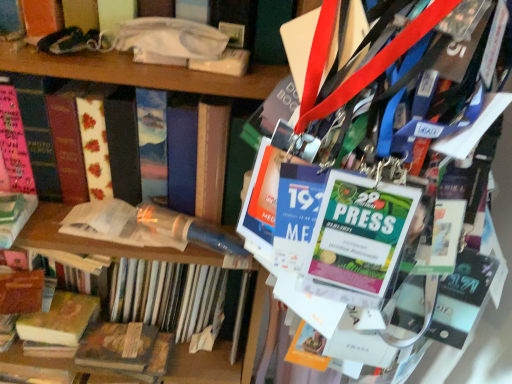
Question: Is translucent plastic tube at center, the second book in the top-to-bottom sequence, thinner than yellow paperback book at lower left, which ranks as the 2th book in bottom-to-top order?

Choices:
 (A) no
 (B) yes

Answer: (A)

Question: Considering the relative positions of translucent plastic tube at center, which is counted as the 3th book, starting from the bottom, and yellow paperback book at lower left, which appears as the third book when viewed from the top, in the image provided, is translucent plastic tube at center, which is counted as the 3th book, starting from the bottom, to the left of yellow paperback book at lower left, which appears as the third book when viewed from the top, from the viewer's perspective?

Choices:
 (A) yes
 (B) no

Answer: (B)

Question: From a real-world perspective, does translucent plastic tube at center, the second book in the top-to-bottom sequence, sit lower than yellow paperback book at lower left, which ranks as the 2th book in bottom-to-top order?

Choices:
 (A) yes
 (B) no

Answer: (B)

Question: Is translucent plastic tube at center, the second book in the top-to-bottom sequence, outside of yellow paperback book at lower left, which ranks as the 2th book in bottom-to-top order?

Choices:
 (A) no
 (B) yes

Answer: (B)

Question: Can you confirm if translucent plastic tube at center, the second book in the top-to-bottom sequence, is taller than yellow paperback book at lower left, which ranks as the 2th book in bottom-to-top order?

Choices:
 (A) yes
 (B) no

Answer: (A)

Question: Considering the relative positions of wooden book at lower left, the fourth book when ordered from top to bottom, and yellow paperback book at lower left, which appears as the third book when viewed from the top, in the image provided, is wooden book at lower left, the fourth book when ordered from top to bottom, to the left or to the right of yellow paperback book at lower left, which appears as the third book when viewed from the top,?

Choices:
 (A) right
 (B) left

Answer: (A)

Question: Considering the positions of point (129, 354) and point (65, 316), is point (129, 354) closer or farther from the camera than point (65, 316)?

Choices:
 (A) closer
 (B) farther

Answer: (A)

Question: From a real-world perspective, is wooden book at lower left, the fourth book when ordered from top to bottom, above or below yellow paperback book at lower left, which ranks as the 2th book in bottom-to-top order?

Choices:
 (A) above
 (B) below

Answer: (B)

Question: Is wooden book at lower left, the fourth book when ordered from top to bottom, bigger or smaller than yellow paperback book at lower left, which ranks as the 2th book in bottom-to-top order?

Choices:
 (A) big
 (B) small

Answer: (A)

Question: In the image, is wooden book at lower left, the fourth book when ordered from top to bottom, positioned in front of or behind hardcover book at left, acting as the first book starting from the top?

Choices:
 (A) behind
 (B) front

Answer: (A)

Question: Is point (170, 342) positioned closer to the camera than point (1, 130)?

Choices:
 (A) farther
 (B) closer

Answer: (A)

Question: Visually, is wooden book at lower left, the fourth book when ordered from top to bottom, positioned to the left or to the right of hardcover book at left, acting as the first book starting from the top?

Choices:
 (A) left
 (B) right

Answer: (A)

Question: Looking at their shapes, would you say wooden book at lower left, which is the 1th book in bottom-to-top order, is wider or thinner than hardcover book at left, which is counted as the 4th book, starting from the bottom?

Choices:
 (A) wide
 (B) thin

Answer: (B)

Question: Considering their positions, is hardcover book at left, which is counted as the 4th book, starting from the bottom, located in front of or behind yellow paperback book at lower left, which ranks as the 2th book in bottom-to-top order?

Choices:
 (A) front
 (B) behind

Answer: (A)

Question: Does point (134, 119) appear closer or farther from the camera than point (91, 299)?

Choices:
 (A) farther
 (B) closer

Answer: (B)